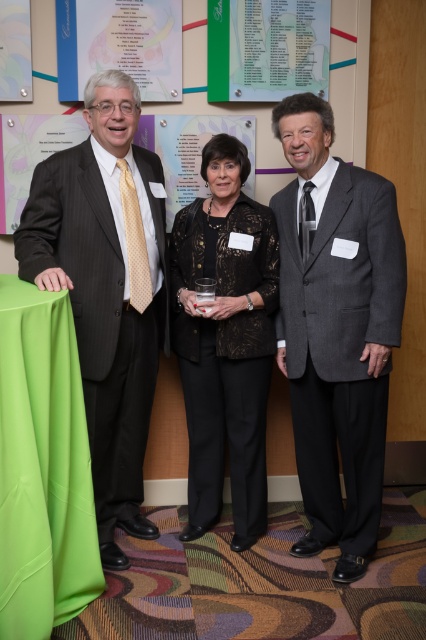
Question: Can you confirm if matte black suit at left is smaller than green paperboard poster at upper center?

Choices:
 (A) no
 (B) yes

Answer: (A)

Question: Which point is farther to the camera?

Choices:
 (A) matte black suit at left
 (B) black lace blouse at center

Answer: (B)

Question: In this image, where is green satin tablecloth at lower left located relative to green paperboard poster at upper center?

Choices:
 (A) left
 (B) right

Answer: (A)

Question: Among these objects, which one is farthest from the camera?

Choices:
 (A) black lace blouse at center
 (B) gray textured suit at center
 (C) green satin tablecloth at lower left
 (D) matte black suit at left

Answer: (A)

Question: Does gray textured suit at center come in front of green satin tablecloth at lower left?

Choices:
 (A) yes
 (B) no

Answer: (B)

Question: Estimate the real-world distances between objects in this image. Which object is farther from the black lace blouse at center?

Choices:
 (A) matte black suit at left
 (B) gray textured suit at center

Answer: (A)